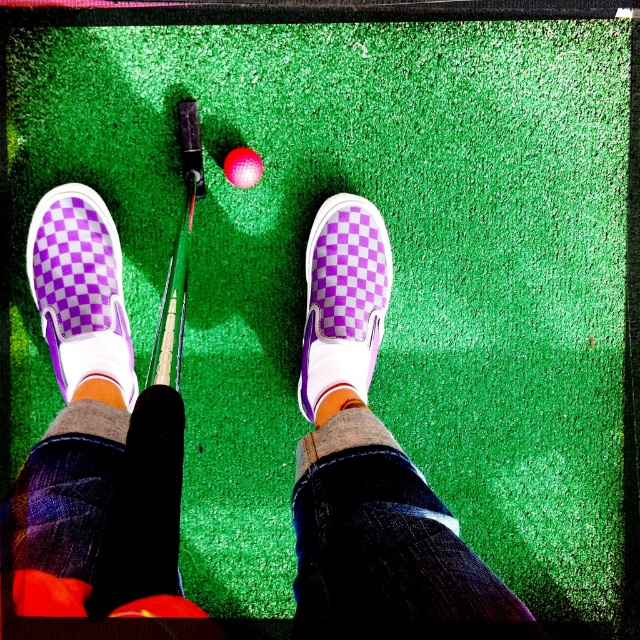
Question: Which point is farther to the camera?

Choices:
 (A) purple checkered shoes at center
 (B) purple checkered slip-on at left

Answer: (B)

Question: Which point appears closest to the camera in this image?

Choices:
 (A) (68, 458)
 (B) (232, 173)
 (C) (349, 208)

Answer: (A)

Question: Is purple checkered shoes at center wider than metallic silver golf club at center?

Choices:
 (A) no
 (B) yes

Answer: (B)

Question: Which of the following is the closest to the observer?

Choices:
 (A) matte pink golf ball at center
 (B) metallic silver golf club at center
 (C) purple checkered slip-on shoe at center
 (D) purple checkered shoes at center

Answer: (D)

Question: Considering the relative positions of purple checkered shoes at center and orange fabric sock at center in the image provided, where is purple checkered shoes at center located with respect to orange fabric sock at center?

Choices:
 (A) right
 (B) left

Answer: (B)

Question: Can you confirm if purple checkered slip-on at left is wider than orange fabric sock at center?

Choices:
 (A) no
 (B) yes

Answer: (B)